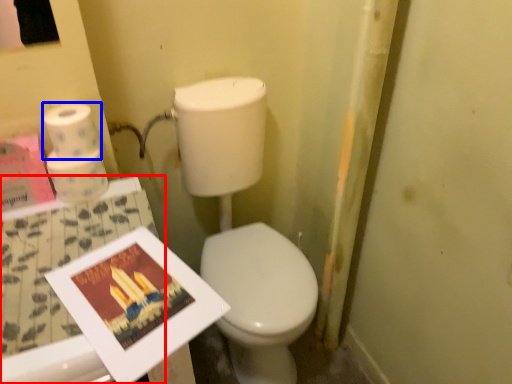
Question: Among these objects, which one is farthest to the camera, table (highlighted by a red box) or toilet paper (highlighted by a blue box)?

Choices:
 (A) table
 (B) toilet paper

Answer: (B)